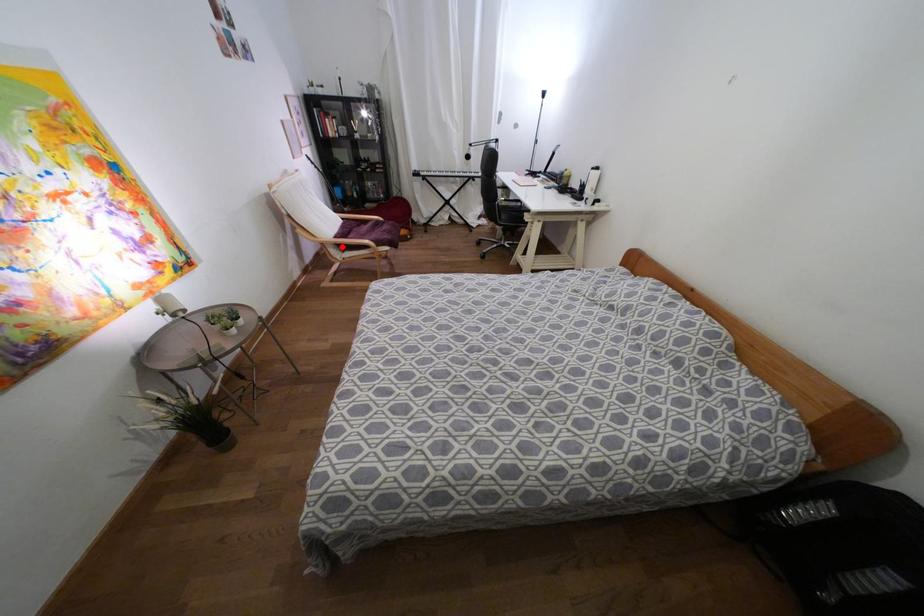
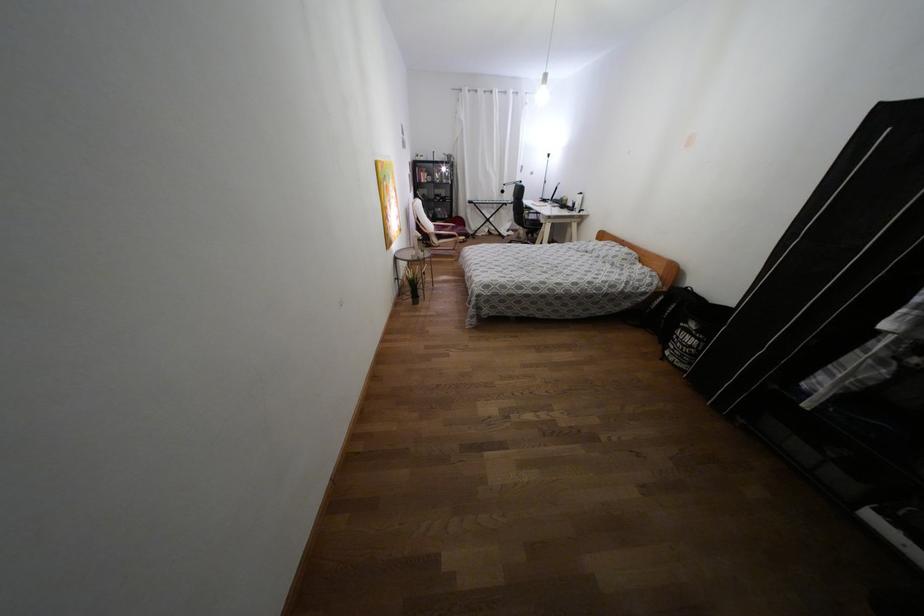
Question: A red point is marked in image1. In image2, is the corresponding 3D point closer to the camera or farther? Reply with the corresponding letter.

Choices:
 (A) The corresponding 3D point is closer.
 (B) The corresponding 3D point is farther.

Answer: (A)